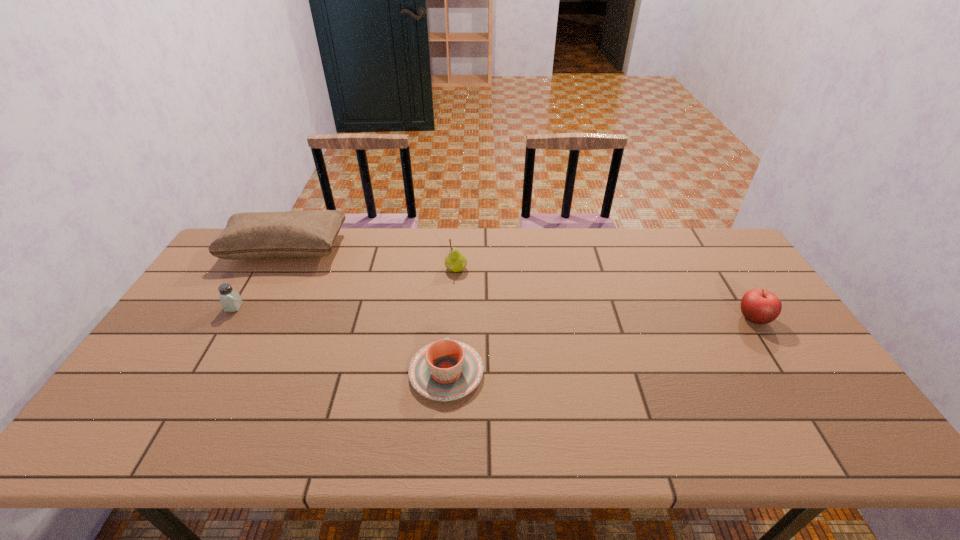
At what (x,y) coordinates should I click in order to perform the action: click on vacant space located on the handle side of the chinaware. Please return your answer as a coordinate pair (x, y). Image resolution: width=960 pixels, height=540 pixels. Looking at the image, I should click on (449, 325).

Locate an element on the screen. vacant area situated 0.050m on the handle side of the chinaware is located at coordinates (449, 330).

The height and width of the screenshot is (540, 960). I want to click on vacant space located on the handle side of the chinaware, so click(x=453, y=271).

At what (x,y) coordinates should I click in order to perform the action: click on cushion that is positioned at the far edge. Please return your answer as a coordinate pair (x, y). The height and width of the screenshot is (540, 960). Looking at the image, I should click on (x=251, y=235).

This screenshot has height=540, width=960. What are the coordinates of `pear that is at the far edge` in the screenshot? It's located at (455, 261).

At what (x,y) coordinates should I click in order to perform the action: click on cushion located in the left edge section of the desktop. Please return your answer as a coordinate pair (x, y). This screenshot has height=540, width=960. Looking at the image, I should click on (251, 235).

This screenshot has width=960, height=540. I want to click on saltshaker situated at the left edge, so click(230, 299).

You are a GUI agent. You are given a task and a screenshot of the screen. Output one action in this format:
    pyautogui.click(x=<x>, y=<y>)
    Task: Click on the object at the right edge
    
    Given the screenshot: What is the action you would take?
    pyautogui.click(x=759, y=306)

You are a GUI agent. You are given a task and a screenshot of the screen. Output one action in this format:
    pyautogui.click(x=<x>, y=<y>)
    Task: Click on the object located at the far left corner
    
    Given the screenshot: What is the action you would take?
    pyautogui.click(x=251, y=235)

Find the location of a particular element. Image resolution: width=960 pixels, height=540 pixels. vacant space at the far edge is located at coordinates point(670,239).